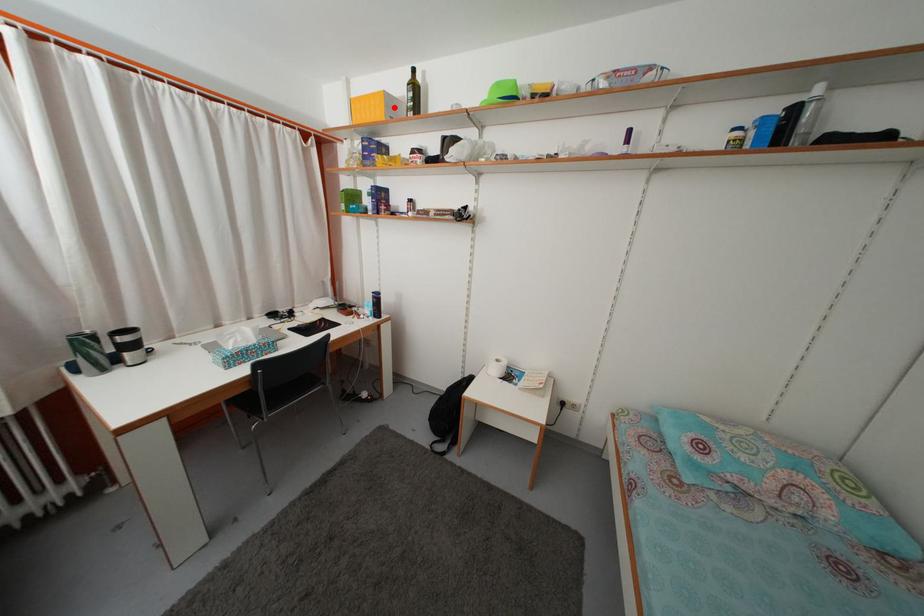
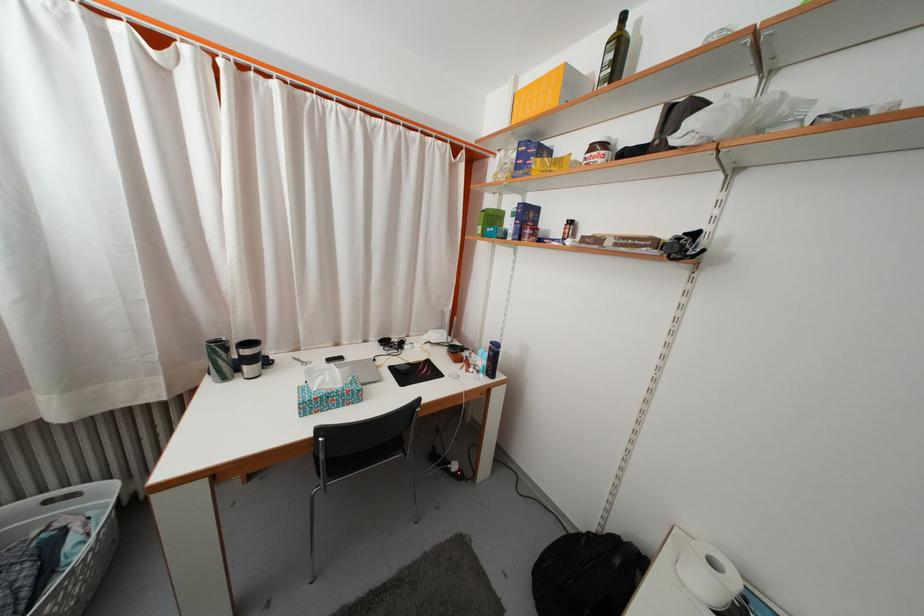
Locate, in the second image, the point that corresponds to the highlighted location in the first image.

(575, 84)